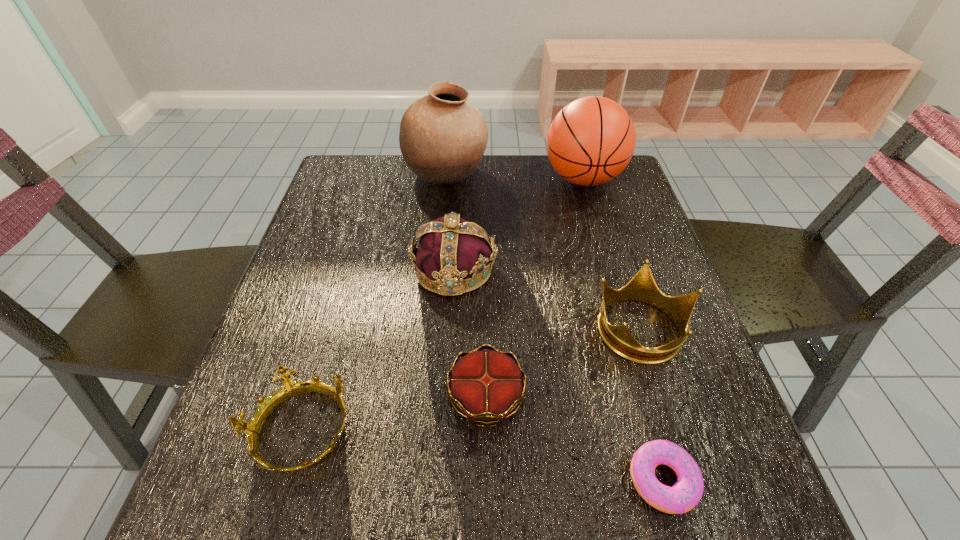
What are the coordinates of `free space located 0.060m on the back of the rightmost crown` in the screenshot? It's located at (624, 274).

Where is `free point located on the back of the leftmost crown`? free point located on the back of the leftmost crown is located at coordinates (355, 244).

The height and width of the screenshot is (540, 960). Find the location of `free space located on the left of the shortest object`. free space located on the left of the shortest object is located at coordinates (495, 480).

At what (x,y) coordinates should I click in order to perform the action: click on pottery at the far edge. Please return your answer as a coordinate pair (x, y). The height and width of the screenshot is (540, 960). Looking at the image, I should click on (442, 137).

Locate an element on the screen. This screenshot has width=960, height=540. basketball that is positioned at the far edge is located at coordinates (591, 140).

The height and width of the screenshot is (540, 960). I want to click on crown that is positioned at the near edge, so click(x=290, y=388).

Image resolution: width=960 pixels, height=540 pixels. In order to click on doughnut that is at the near edge in this screenshot , I will do `click(684, 495)`.

The width and height of the screenshot is (960, 540). I want to click on object at the left edge, so click(x=290, y=388).

I want to click on basketball that is at the right edge, so (591, 140).

Image resolution: width=960 pixels, height=540 pixels. I want to click on crown positioned at the right edge, so click(x=642, y=287).